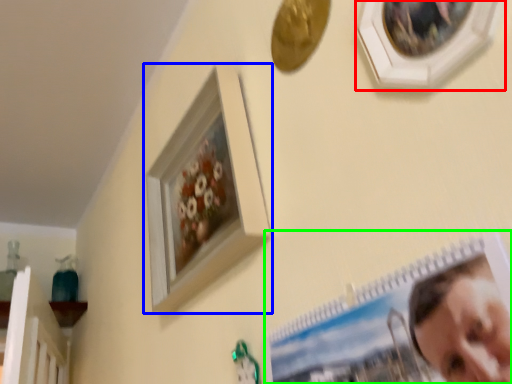
Question: Which object is the farthest from picture frame (highlighted by a red box)? Choose among these: picture frame (highlighted by a blue box) or picture frame (highlighted by a green box).

Choices:
 (A) picture frame
 (B) picture frame

Answer: (A)